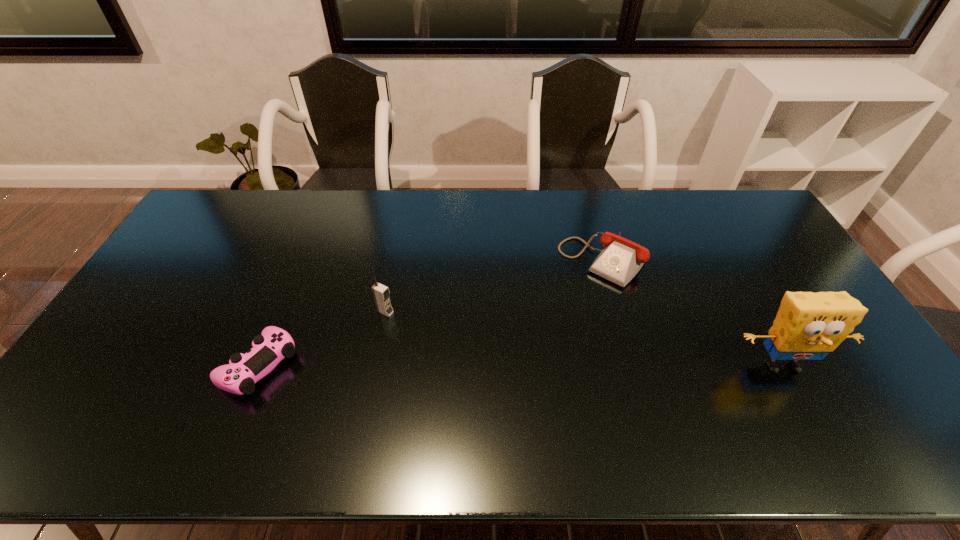
Locate an element on the screen. Image resolution: width=960 pixels, height=540 pixels. vacant area that lies between the second object from left to right and the third object from left to right is located at coordinates (494, 286).

Where is `free space between the telephone and the third nearest object`? The height and width of the screenshot is (540, 960). free space between the telephone and the third nearest object is located at coordinates (494, 286).

You are a GUI agent. You are given a task and a screenshot of the screen. Output one action in this format:
    pyautogui.click(x=<x>, y=<y>)
    Task: Click on the unoccupied area between the leftmost object and the farthest object
    
    Given the screenshot: What is the action you would take?
    pyautogui.click(x=431, y=313)

Locate an element on the screen. This screenshot has width=960, height=540. free space between the sponge and the control is located at coordinates (520, 366).

Locate which object ranks second in proximity to the third object from right to left. Please provide its 2D coordinates. Your answer should be formatted as a tuple, i.e. [(x, y)], where the tuple contains the x and y coordinates of a point satisfying the conditions above.

[(621, 259)]

The width and height of the screenshot is (960, 540). Identify the location of object that is the closest to the tallest object. (621, 259).

Locate an element on the screen. This screenshot has height=540, width=960. vacant space that satisfies the following two spatial constraints: 1. on the back side of the telephone; 2. on the left side of the leftmost object is located at coordinates (300, 260).

Identify the location of vacant area that satisfies the following two spatial constraints: 1. on the back side of the telephone; 2. on the right side of the cellular telephone. (396, 260).